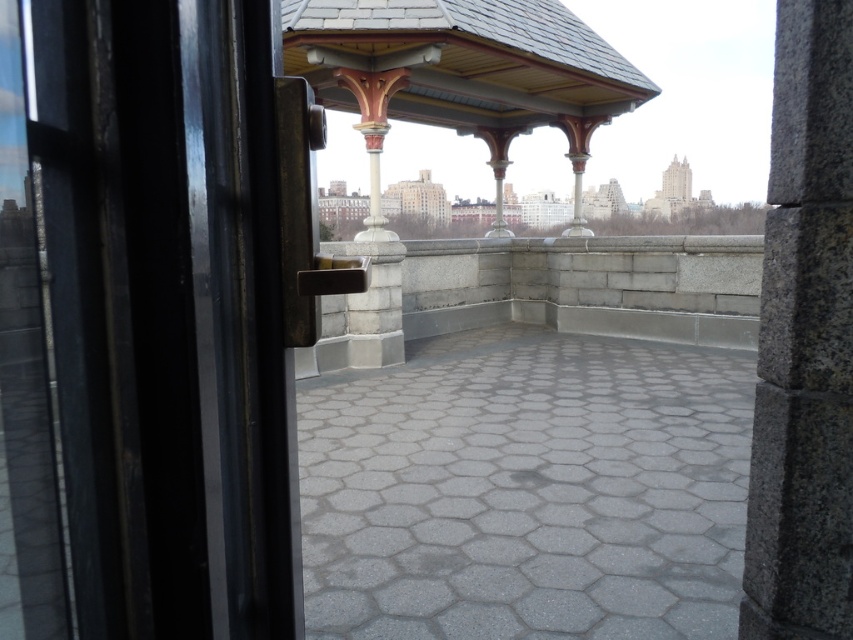
You are an architect examining the terrace and notice both the polished bronze column at center and the polished stone column at center. Based on their positions, which one is positioned lower in the vertical direction?

The polished bronze column at center is located below the polished stone column at center, so it is positioned lower in the vertical direction.

You are standing on the rooftop terrace and want to move from the granite pillar at right to the polished stone column at center. Which direction should you walk to reach it?

You should walk to your left to reach the polished stone column at center because the granite pillar at right is positioned to the right of you, and the polished stone column at center is to the left of the granite pillar at right.

In the scene shown: You are an architect inspecting the rooftop terrace. You need to determine which object is shorter between the granite pillar at right and the polished stone column at center. Can you identify the shorter one based on the provided description?

The granite pillar at right has a lesser height compared to the polished stone column at center, so the granite pillar at right is shorter.